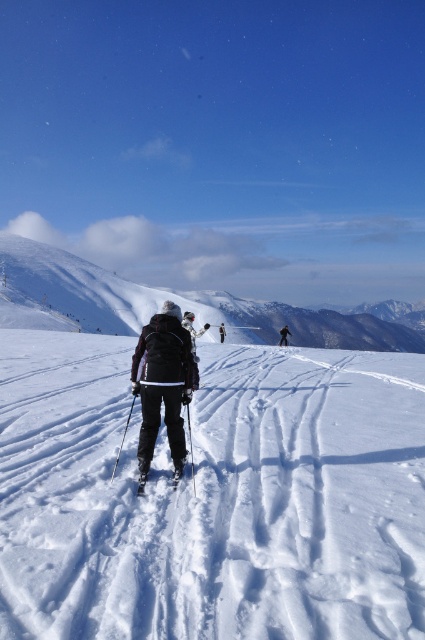
Question: Among these objects, which one is farthest from the camera?

Choices:
 (A) white matte ski at center
 (B) black plastic ski pole at center

Answer: (B)

Question: Estimate the real-world distances between objects in this image. Which object is closer to the black ski suit at center?

Choices:
 (A) black plastic ski pole at center
 (B) matte black jacket at center

Answer: (B)

Question: In this image, where is snowy white mountain at upper left located relative to matte black jacket at center?

Choices:
 (A) below
 (B) above

Answer: (B)

Question: Which of the following is the farthest from the observer?

Choices:
 (A) white matte ski at center
 (B) white powdery snow at center
 (C) snowy white mountain at upper left

Answer: (C)

Question: Can you confirm if black ski suit at center is wider than dark gray ski suit at center?

Choices:
 (A) yes
 (B) no

Answer: (A)

Question: Is matte black jacket at center positioned at the back of dark gray ski suit at center?

Choices:
 (A) no
 (B) yes

Answer: (A)